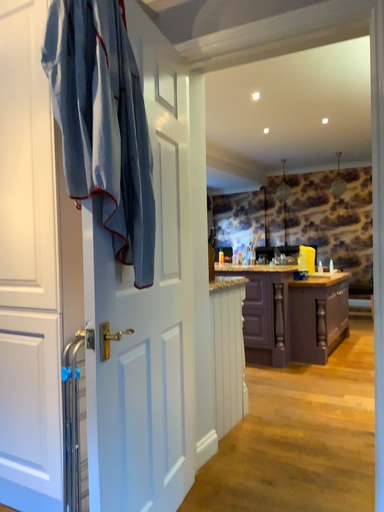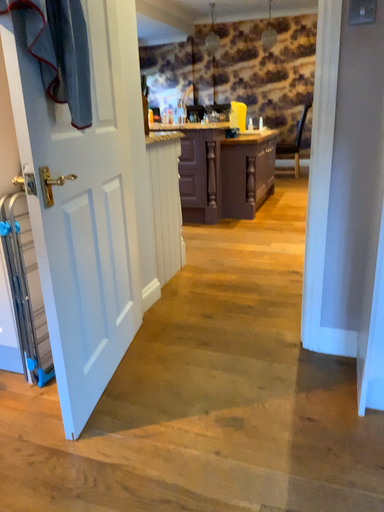
Question: Which way did the camera rotate in the video?

Choices:
 (A) rotated upward
 (B) rotated downward

Answer: (B)